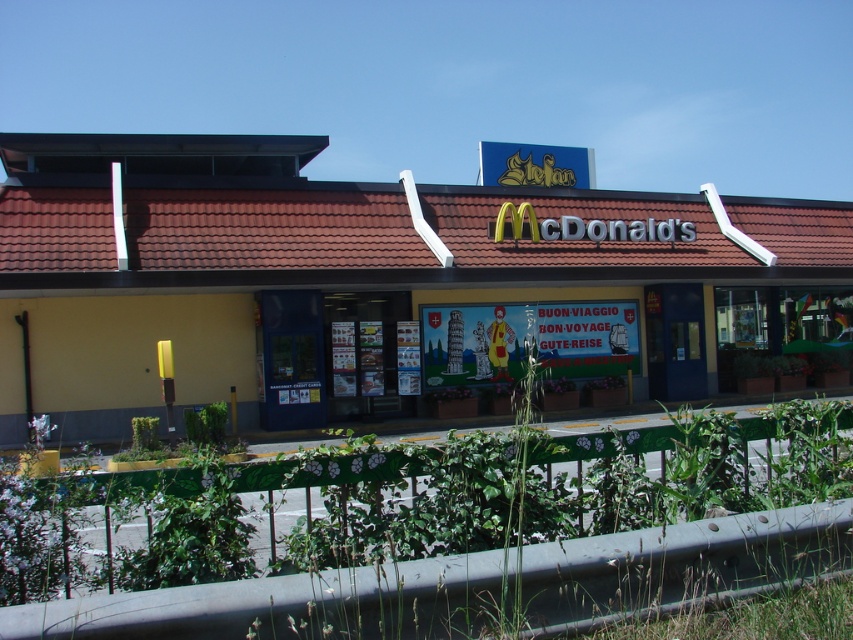
Question: Among these points, which one is nearest to the camera?

Choices:
 (A) (787, 204)
 (B) (790, 548)

Answer: (B)

Question: Among these objects, which one is farthest from the camera?

Choices:
 (A) green leafy plant at lower center
 (B) yellow matte mcdonald's at center

Answer: (B)

Question: Which object appears closest to the camera in this image?

Choices:
 (A) yellow matte mcdonald's at center
 (B) green leafy plant at lower center

Answer: (B)

Question: Can you confirm if yellow matte mcdonald's at center is wider than green leafy plant at lower center?

Choices:
 (A) no
 (B) yes

Answer: (B)

Question: Can you confirm if yellow matte mcdonald's at center is wider than green leafy plant at lower center?

Choices:
 (A) yes
 (B) no

Answer: (A)

Question: Is yellow matte mcdonald's at center to the right of green leafy plant at lower center from the viewer's perspective?

Choices:
 (A) no
 (B) yes

Answer: (A)